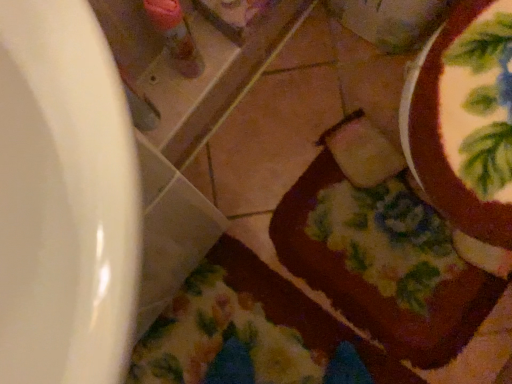
Question: From the image's perspective, relative to floral fabric blanket at lower center, is chocolate frosted cake at lower right above or below?

Choices:
 (A) above
 (B) below

Answer: (A)

Question: Is chocolate frosted cake at lower right inside or outside of floral fabric blanket at lower center?

Choices:
 (A) outside
 (B) inside

Answer: (A)

Question: Based on their sizes in the image, would you say chocolate frosted cake at lower right is bigger or smaller than floral fabric blanket at lower center?

Choices:
 (A) big
 (B) small

Answer: (A)

Question: Is floral fabric blanket at lower center inside the boundaries of chocolate frosted cake at lower right, or outside?

Choices:
 (A) inside
 (B) outside

Answer: (B)

Question: Looking at the image, does floral fabric blanket at lower center seem bigger or smaller compared to chocolate frosted cake at lower right?

Choices:
 (A) small
 (B) big

Answer: (A)

Question: From the image's perspective, is floral fabric blanket at lower center located above or below chocolate frosted cake at lower right?

Choices:
 (A) below
 (B) above

Answer: (A)

Question: Based on their positions, is floral fabric blanket at lower center located to the left or right of chocolate frosted cake at lower right?

Choices:
 (A) right
 (B) left

Answer: (B)